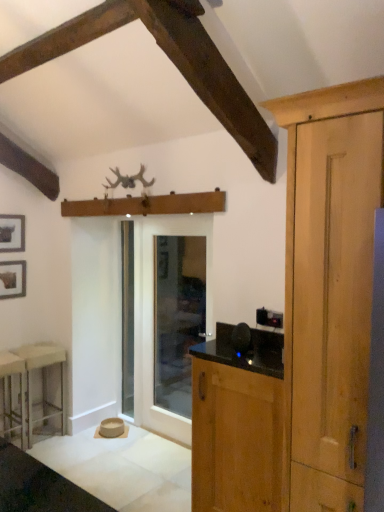
I want to click on clear glass door at center, which is counted as the 1th screen door, starting from the right, so [153, 315].

Locate an element on the screen. The height and width of the screenshot is (512, 384). matte black picture frame at upper left, which appears as the second picture frame when ordered from the bottom is located at coordinates (12, 233).

The height and width of the screenshot is (512, 384). Describe the element at coordinates (12, 279) in the screenshot. I see `matte black picture frame at left, the 1th picture frame when ordered from bottom to top` at that location.

This screenshot has height=512, width=384. What do you see at coordinates (127, 317) in the screenshot? I see `clear glass screen door at center, the 1th screen door from the left` at bounding box center [127, 317].

Identify the location of metallic silver stool at lower left, which ranks as the 1th stool in front-to-back order. (11, 391).

Considering the relative positions of metallic silver stool at lower left, which ranks as the 1th stool in front-to-back order, and matte black picture frame at upper left, which appears as the first picture frame when viewed from the top, in the image provided, is metallic silver stool at lower left, which ranks as the 1th stool in front-to-back order, to the left or to the right of matte black picture frame at upper left, which appears as the first picture frame when viewed from the top,?

Clearly, metallic silver stool at lower left, which ranks as the 1th stool in front-to-back order, is on the right of matte black picture frame at upper left, which appears as the first picture frame when viewed from the top, in the image.

Looking at the image, does metallic silver stool at lower left, which is the 2th stool from back to front, seem bigger or smaller compared to matte black picture frame at upper left, which appears as the second picture frame when ordered from the bottom?

metallic silver stool at lower left, which is the 2th stool from back to front, is bigger than matte black picture frame at upper left, which appears as the second picture frame when ordered from the bottom.

Is point (9, 373) closer to viewer compared to point (4, 248)?

Yes, point (9, 373) is closer to viewer.

How many degrees apart are the facing directions of metallic silver stool at lower left, which is the 2th stool from back to front, and matte black picture frame at upper left, which appears as the first picture frame when viewed from the top?

The facing directions of metallic silver stool at lower left, which is the 2th stool from back to front, and matte black picture frame at upper left, which appears as the first picture frame when viewed from the top, are 0.00563 degrees apart.

Considering the sizes of objects matte black picture frame at upper left, which appears as the first picture frame when viewed from the top, and clear glass screen door at center, the 1th screen door from the left, in the image provided, who is smaller, matte black picture frame at upper left, which appears as the first picture frame when viewed from the top, or clear glass screen door at center, the 1th screen door from the left,?

Smaller between the two is matte black picture frame at upper left, which appears as the first picture frame when viewed from the top.

From the image's perspective, count 2nd picture frames upward from the clear glass screen door at center, which ranks as the second screen door in right-to-left order, and point to it. Please provide its 2D coordinates.

[(12, 233)]

Is matte black picture frame at upper left, which appears as the first picture frame when viewed from the top, completely or partially outside of clear glass screen door at center, the 1th screen door from the left?

matte black picture frame at upper left, which appears as the first picture frame when viewed from the top, lies outside clear glass screen door at center, the 1th screen door from the left,'s area.

Is matte black picture frame at upper left, which appears as the first picture frame when viewed from the top, wider than clear glass screen door at center, the 1th screen door from the left?

No.

From a real-world perspective, which is physically below, wooden cabinet at right or matte black picture frame at left, the 1th picture frame when ordered from bottom to top?

wooden cabinet at right, from a real-world perspective.

Is wooden cabinet at right closer to the viewer compared to matte black picture frame at left, acting as the second picture frame starting from the top?

Yes, wooden cabinet at right is closer to the camera.

Does wooden cabinet at right appear on the left side of matte black picture frame at left, acting as the second picture frame starting from the top?

No, wooden cabinet at right is not to the left of matte black picture frame at left, acting as the second picture frame starting from the top.

Is clear glass screen door at center, the 1th screen door from the left, taller or shorter than wooden cabinet at right?

Considering their sizes, clear glass screen door at center, the 1th screen door from the left, has more height than wooden cabinet at right.

Which of these two, clear glass screen door at center, which ranks as the second screen door in right-to-left order, or wooden cabinet at right, is bigger?

Bigger between the two is wooden cabinet at right.

From the image's perspective, which is below, clear glass screen door at center, which ranks as the second screen door in right-to-left order, or wooden cabinet at right?

wooden cabinet at right is shown below in the image.

In the image, is clear glass screen door at center, which ranks as the second screen door in right-to-left order, positioned in front of or behind wooden cabinet at right?

Clearly, clear glass screen door at center, which ranks as the second screen door in right-to-left order, is behind wooden cabinet at right.

Considering the relative sizes of matte black picture frame at upper left, which appears as the first picture frame when viewed from the top, and white plastic stool at left, the second stool when ordered from front to back, in the image provided, is matte black picture frame at upper left, which appears as the first picture frame when viewed from the top, shorter than white plastic stool at left, the second stool when ordered from front to back,?

Indeed, matte black picture frame at upper left, which appears as the first picture frame when viewed from the top, has a lesser height compared to white plastic stool at left, the second stool when ordered from front to back.

In the scene shown: From the image's perspective, between matte black picture frame at upper left, which appears as the second picture frame when ordered from the bottom, and white plastic stool at left, the second stool when ordered from front to back, who is located below?

white plastic stool at left, the second stool when ordered from front to back.

Could you tell me if matte black picture frame at upper left, which appears as the second picture frame when ordered from the bottom, is facing white plastic stool at left, the 1th stool positioned from the back?

No, matte black picture frame at upper left, which appears as the second picture frame when ordered from the bottom, is not aimed at white plastic stool at left, the 1th stool positioned from the back.

Is white plastic stool at left, the 1th stool positioned from the back, not within metallic silver stool at lower left, which is the 2th stool from back to front?

Yes.

Which of these two, white plastic stool at left, the second stool when ordered from front to back, or metallic silver stool at lower left, which is the 2th stool from back to front, is thinner?

white plastic stool at left, the second stool when ordered from front to back, is thinner.

Is white plastic stool at left, the second stool when ordered from front to back, taller or shorter than metallic silver stool at lower left, which ranks as the 1th stool in front-to-back order?

Considering their sizes, white plastic stool at left, the second stool when ordered from front to back, has more height than metallic silver stool at lower left, which ranks as the 1th stool in front-to-back order.

Consider the image. Is white plastic stool at left, the 1th stool positioned from the back, oriented away from metallic silver stool at lower left, which is the 2th stool from back to front?

That's not correct — white plastic stool at left, the 1th stool positioned from the back, is not looking away from metallic silver stool at lower left, which is the 2th stool from back to front.

From a real-world perspective, who is located lower, clear glass screen door at center, which ranks as the second screen door in right-to-left order, or matte black picture frame at upper left, which appears as the second picture frame when ordered from the bottom?

In real-world perspective, clear glass screen door at center, which ranks as the second screen door in right-to-left order, is lower.

Is clear glass screen door at center, the 1th screen door from the left, next to matte black picture frame at upper left, which appears as the first picture frame when viewed from the top, and touching it?

clear glass screen door at center, the 1th screen door from the left, is not next to matte black picture frame at upper left, which appears as the first picture frame when viewed from the top, and they're not touching.

Can you tell me how much clear glass screen door at center, the 1th screen door from the left, and matte black picture frame at upper left, which appears as the second picture frame when ordered from the bottom, differ in facing direction?

The angular difference between clear glass screen door at center, the 1th screen door from the left, and matte black picture frame at upper left, which appears as the second picture frame when ordered from the bottom, is 88 degrees.

Is clear glass screen door at center, the 1th screen door from the left, further to the viewer compared to matte black picture frame at upper left, which appears as the second picture frame when ordered from the bottom?

Yes, the depth of clear glass screen door at center, the 1th screen door from the left, is greater than that of matte black picture frame at upper left, which appears as the second picture frame when ordered from the bottom.

This screenshot has height=512, width=384. I want to click on the 2nd picture frame above the metallic silver stool at lower left, which is the 2th stool from back to front (from the image's perspective), so click(x=12, y=233).

Locate an element on the screen. picture frame that is the 1st one when counting leftward from the clear glass screen door at center, the 1th screen door from the left is located at coordinates [x=12, y=233].

Estimate the real-world distances between objects in this image. Which object is closer to metallic silver stool at lower left, which is the 2th stool from back to front, white plastic stool at left, the 1th stool positioned from the back, or wooden cabinet at right?

The object closer to metallic silver stool at lower left, which is the 2th stool from back to front, is white plastic stool at left, the 1th stool positioned from the back.

From the image, which object appears to be farther from clear glass screen door at center, which ranks as the second screen door in right-to-left order, metallic silver stool at lower left, which ranks as the 1th stool in front-to-back order, or matte black picture frame at upper left, which appears as the second picture frame when ordered from the bottom?

metallic silver stool at lower left, which ranks as the 1th stool in front-to-back order, is positioned further to the anchor clear glass screen door at center, which ranks as the second screen door in right-to-left order.

Considering their positions, is metallic silver stool at lower left, which is the 2th stool from back to front, positioned further to white plastic stool at left, the second stool when ordered from front to back, than matte black picture frame at left, acting as the second picture frame starting from the top?

matte black picture frame at left, acting as the second picture frame starting from the top, is further to white plastic stool at left, the second stool when ordered from front to back.

When comparing their distances from white plastic stool at left, the 1th stool positioned from the back, does metallic silver stool at lower left, which is the 2th stool from back to front, or clear glass screen door at center, which ranks as the second screen door in right-to-left order, seem closer?

metallic silver stool at lower left, which is the 2th stool from back to front, is positioned closer to the anchor white plastic stool at left, the 1th stool positioned from the back.

From the image, which object appears to be nearer to clear glass screen door at center, which ranks as the second screen door in right-to-left order, metallic silver stool at lower left, which ranks as the 1th stool in front-to-back order, or wooden cabinet at right?

The object closer to clear glass screen door at center, which ranks as the second screen door in right-to-left order, is metallic silver stool at lower left, which ranks as the 1th stool in front-to-back order.

Looking at this image, considering their positions, is matte black picture frame at left, the 1th picture frame when ordered from bottom to top, positioned further to clear glass door at center, the 2th screen door when ordered from left to right, than metallic silver stool at lower left, which ranks as the 1th stool in front-to-back order?

metallic silver stool at lower left, which ranks as the 1th stool in front-to-back order.

From the image, which object appears to be nearer to matte black picture frame at upper left, which appears as the second picture frame when ordered from the bottom, clear glass door at center, the 2th screen door when ordered from left to right, or wooden cabinet at right?

The object closer to matte black picture frame at upper left, which appears as the second picture frame when ordered from the bottom, is clear glass door at center, the 2th screen door when ordered from left to right.

From the image, which object appears to be nearer to clear glass door at center, the 2th screen door when ordered from left to right, matte black picture frame at upper left, which appears as the second picture frame when ordered from the bottom, or matte black picture frame at left, acting as the second picture frame starting from the top?

matte black picture frame at left, acting as the second picture frame starting from the top, is positioned closer to the anchor clear glass door at center, the 2th screen door when ordered from left to right.

Where is `stool between metallic silver stool at lower left, which is the 2th stool from back to front, and clear glass door at center, the 2th screen door when ordered from left to right, in the horizontal direction`? The width and height of the screenshot is (384, 512). stool between metallic silver stool at lower left, which is the 2th stool from back to front, and clear glass door at center, the 2th screen door when ordered from left to right, in the horizontal direction is located at coordinates (43, 379).

Where is `stool between metallic silver stool at lower left, which is the 2th stool from back to front, and clear glass screen door at center, the 1th screen door from the left`? The width and height of the screenshot is (384, 512). stool between metallic silver stool at lower left, which is the 2th stool from back to front, and clear glass screen door at center, the 1th screen door from the left is located at coordinates click(x=43, y=379).

The image size is (384, 512). What are the coordinates of `picture frame situated between matte black picture frame at left, the 1th picture frame when ordered from bottom to top, and clear glass door at center, which is counted as the 1th screen door, starting from the right, from left to right` in the screenshot? It's located at (12, 233).

Where is `screen door between metallic silver stool at lower left, which ranks as the 1th stool in front-to-back order, and clear glass door at center, which is counted as the 1th screen door, starting from the right`? This screenshot has width=384, height=512. screen door between metallic silver stool at lower left, which ranks as the 1th stool in front-to-back order, and clear glass door at center, which is counted as the 1th screen door, starting from the right is located at coordinates (127, 317).